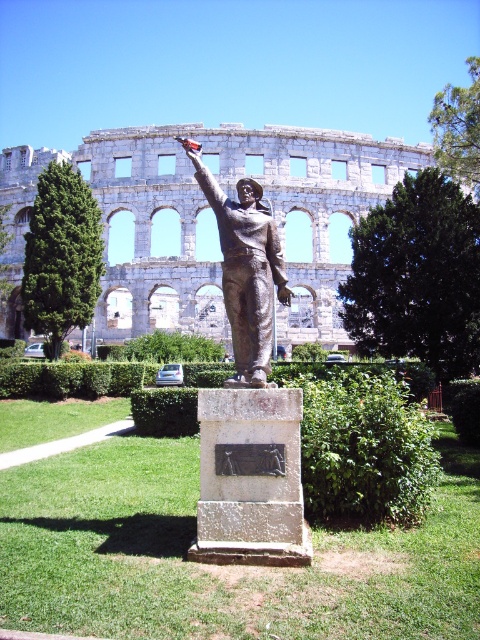
Find the location of a particular element. gray stone amphitheater at upper center is located at coordinates (212, 220).

Is gray stone amphitheater at upper center smaller than bronze statue at center?

No.

Find the location of `gray stone amphitheater at upper center`. gray stone amphitheater at upper center is located at coordinates (212, 220).

Looking at this image, is gray stone amphitheater at upper center closer to camera compared to green leafy hedge at center?

No, it is not.

The width and height of the screenshot is (480, 640). Describe the element at coordinates (212, 220) in the screenshot. I see `gray stone amphitheater at upper center` at that location.

Between point (192, 189) and point (211, 349), which one is positioned in front?

Point (211, 349) is in front.

Where is `gray stone amphitheater at upper center`? Image resolution: width=480 pixels, height=640 pixels. gray stone amphitheater at upper center is located at coordinates (212, 220).

The image size is (480, 640). Describe the element at coordinates (245, 269) in the screenshot. I see `bronze statue at center` at that location.

The width and height of the screenshot is (480, 640). I want to click on bronze statue at center, so click(245, 269).